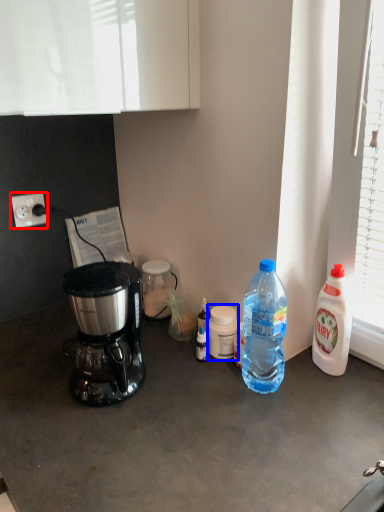
Question: Among these objects, which one is nearest to the camera, power outlet (highlighted by a red box) or bottle (highlighted by a blue box)?

Choices:
 (A) power outlet
 (B) bottle

Answer: (B)